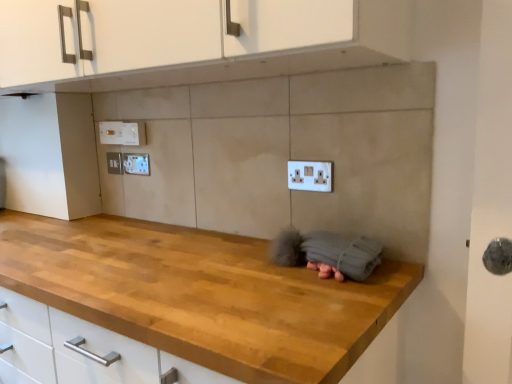
Question: Is white plastic electric outlet at center, which is the fourth electric outlet in left-to-right order, situated inside white plastic electric outlet at upper left, which is the third electric outlet in left-to-right order, or outside?

Choices:
 (A) inside
 (B) outside

Answer: (B)

Question: From the image's perspective, is white plastic electric outlet at center, the first electric outlet positioned from the right, located above or below white plastic electric outlet at upper left, the third electric outlet when ordered from back to front?

Choices:
 (A) above
 (B) below

Answer: (B)

Question: Based on their relative distances, which object is nearer to the white plastic electric outlet at upper left, the second electric outlet positioned from the right?

Choices:
 (A) white plastic electric outlet at upper left, arranged as the 1th electric outlet when viewed from the back
 (B) white plastic electric outlet at center, placed as the fourth electric outlet when sorted from back to front
 (C) white plastic electric outlet at upper left, the second electric outlet positioned from the back

Answer: (A)

Question: Considering the real-world distances, which object is farthest from the white plastic electric outlet at upper left, the second electric outlet positioned from the right?

Choices:
 (A) white plastic electric outlet at upper left, arranged as the 1th electric outlet when viewed from the back
 (B) white plastic electric outlet at center, which is counted as the 1th electric outlet, starting from the front
 (C) white plastic electric outlet at upper left, marked as the 3th electric outlet in a front-to-back arrangement

Answer: (B)